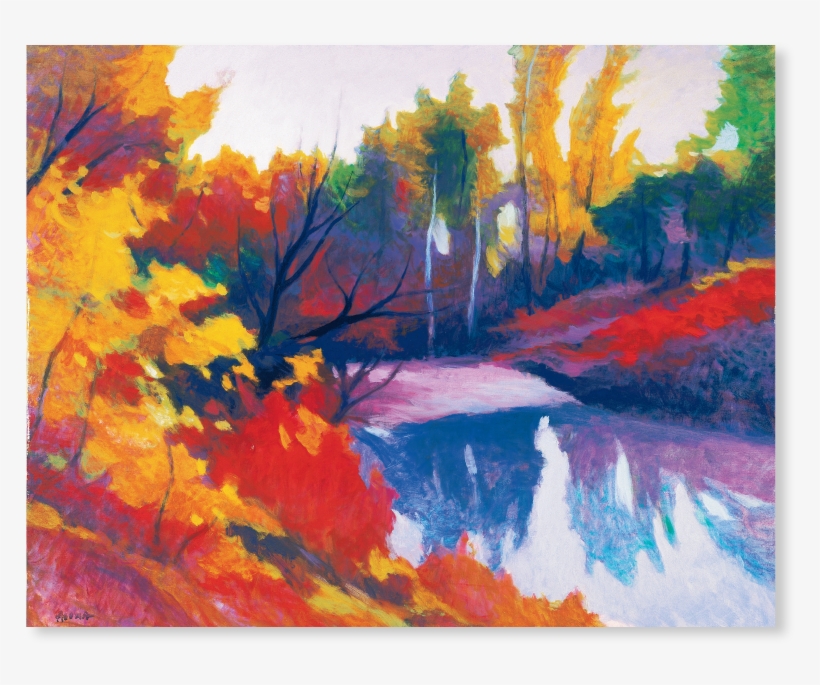
I want to click on background behind the painting, so click(x=269, y=16), click(x=754, y=664), click(x=317, y=664), click(x=800, y=174), click(x=796, y=35).